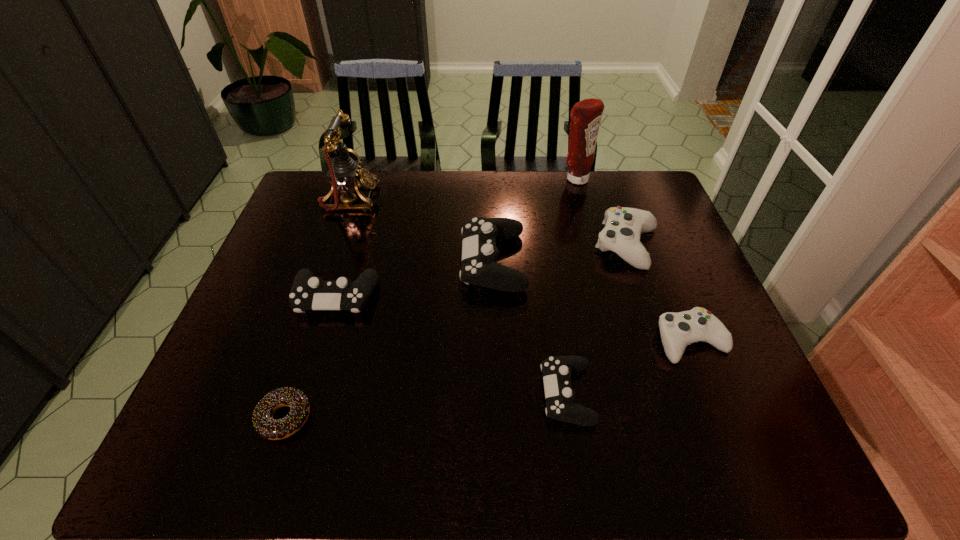
Locate an element on the screen. The width and height of the screenshot is (960, 540). control that is the closest one to the leftmost control is located at coordinates (479, 267).

The image size is (960, 540). I want to click on the second closest black control to the leftmost control, so click(557, 370).

This screenshot has height=540, width=960. I want to click on black control that stands as the closest to the red condiment, so click(x=479, y=267).

The width and height of the screenshot is (960, 540). Identify the location of vacant space that satisfies the following two spatial constraints: 1. on the surface of the fifth object from right to left; 2. on the right side of the smaller white control. (495, 341).

The height and width of the screenshot is (540, 960). Identify the location of vacant point that satisfies the following two spatial constraints: 1. on the surface of the nearer white control; 2. on the left side of the leftmost black control. (322, 341).